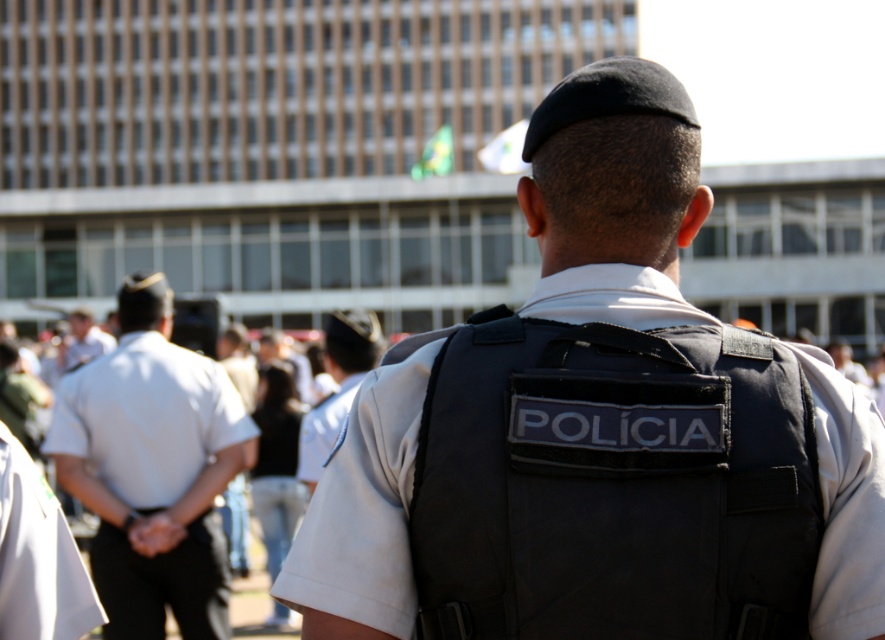
Question: Can you confirm if white uniform shirt at center is wider than light brown leather jacket at left?

Choices:
 (A) yes
 (B) no

Answer: (B)

Question: Which object is closer to the camera taking this photo?

Choices:
 (A) white fabric shirt at center
 (B) light brown leather jacket at left

Answer: (A)

Question: Where is white uniform shirt at center located in relation to white fabric shirt at center in the image?

Choices:
 (A) below
 (B) above

Answer: (A)

Question: Does white uniform at center come in front of white fabric shirt at center?

Choices:
 (A) no
 (B) yes

Answer: (A)

Question: Estimate the real-world distances between objects in this image. Which object is closer to the light brown leather jacket at left?

Choices:
 (A) white fabric shirt at center
 (B) white uniform shirt at center
 (C) dark gray uniform at center
 (D) black fabric vest at center

Answer: (A)

Question: Which point appears closest to the camera in this image?

Choices:
 (A) (351, 348)
 (B) (91, 342)

Answer: (A)